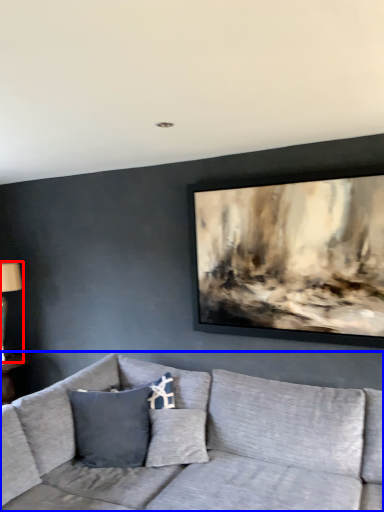
Question: Among these objects, which one is nearest to the camera, table lamp (highlighted by a red box) or studio couch (highlighted by a blue box)?

Choices:
 (A) table lamp
 (B) studio couch

Answer: (B)